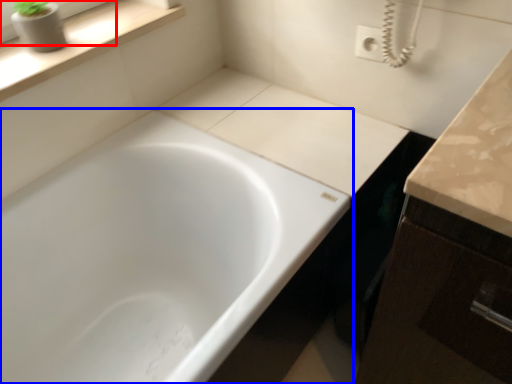
Question: Which object appears closest to the camera in this image, window frame (highlighted by a red box) or bathtub (highlighted by a blue box)?

Choices:
 (A) window frame
 (B) bathtub

Answer: (B)